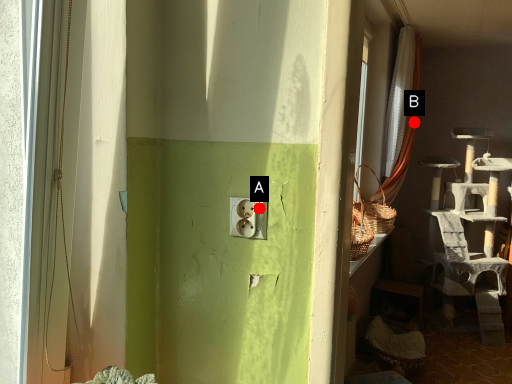
Question: Two points are circled on the image, labeled by A and B beside each circle. Which point appears closest to the camera in this image?

Choices:
 (A) A is closer
 (B) B is closer

Answer: (A)